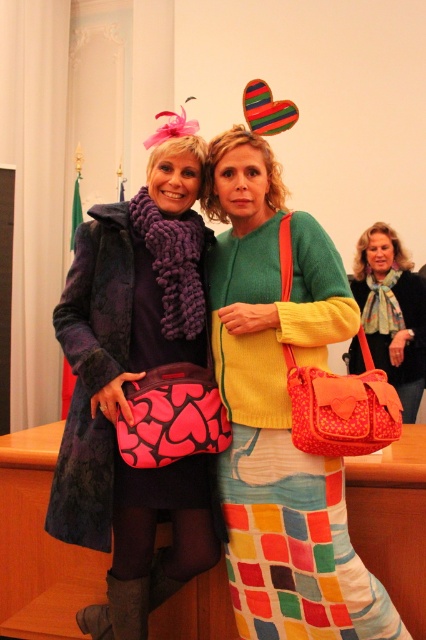
Question: Which object is positioned farthest from the multicolored textured skirt at center?

Choices:
 (A) matte pink purse at center
 (B) matte purple scarf at left

Answer: (A)

Question: Is multicolored textured skirt at center positioned at the back of matte pink purse at center?

Choices:
 (A) no
 (B) yes

Answer: (A)

Question: Can you confirm if matte purple scarf at left is positioned above matte pink purse at center?

Choices:
 (A) yes
 (B) no

Answer: (B)

Question: Which point appears farthest from the camera in this image?

Choices:
 (A) (376, 323)
 (B) (294, 221)

Answer: (A)

Question: Which point is farther to the camera?

Choices:
 (A) (365, 257)
 (B) (330, 467)
 (C) (100, 248)

Answer: (A)

Question: Can you confirm if multicolored textured skirt at center is wider than matte pink purse at center?

Choices:
 (A) no
 (B) yes

Answer: (B)